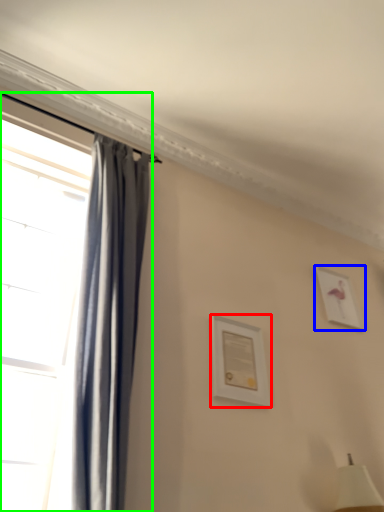
Question: Which object is the farthest from picture frame (highlighted by a red box)? Choose among these: picture frame (highlighted by a blue box) or window (highlighted by a green box).

Choices:
 (A) picture frame
 (B) window

Answer: (A)